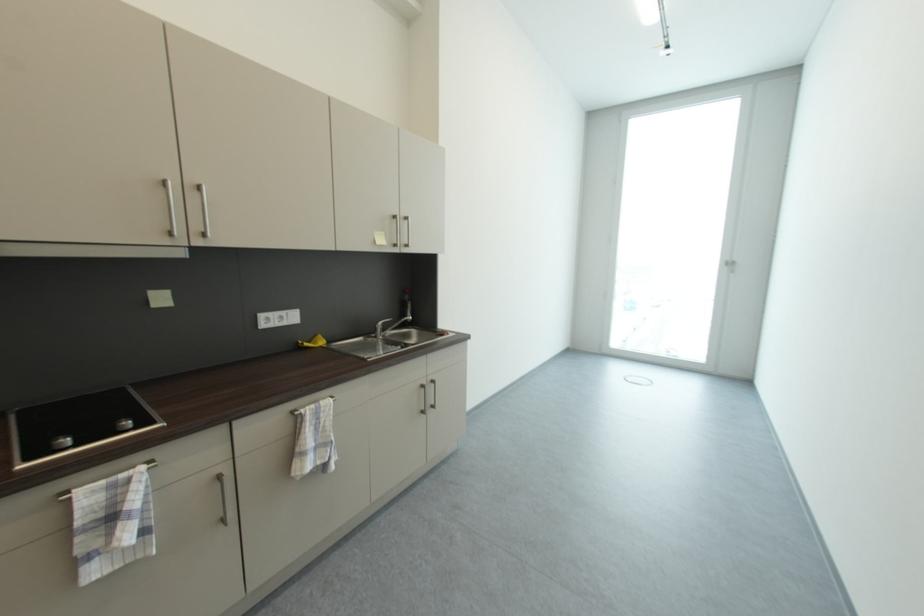
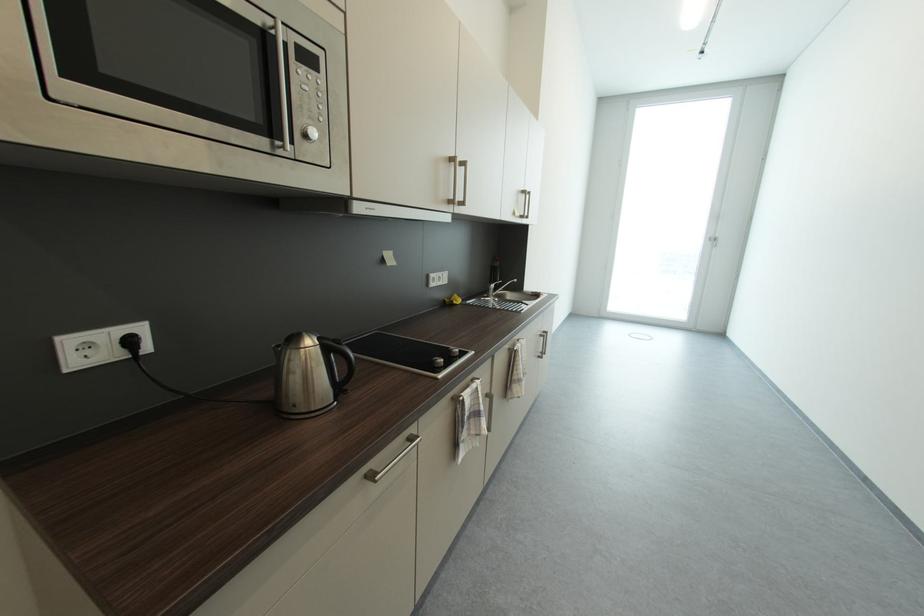
The point at (305, 344) is marked in the first image. Where is the corresponding point in the second image?

(453, 302)